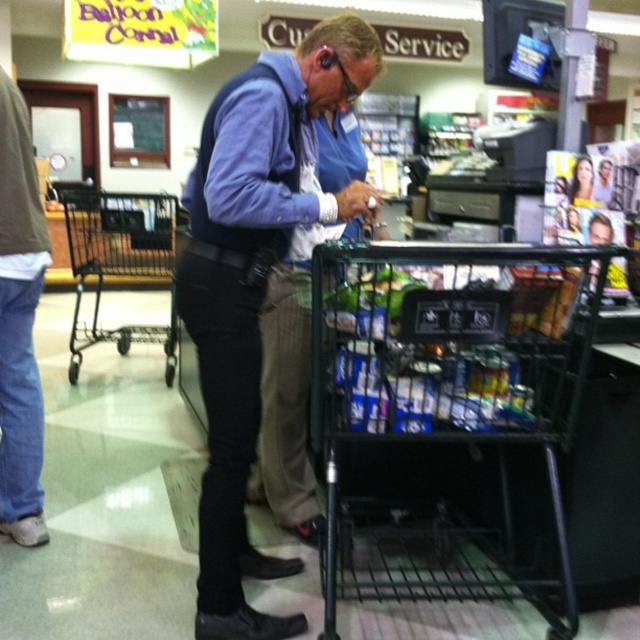
You are a customer in the store and want to ask the employee about the location of the nearest restroom. Which direction should you walk relative to the denim jeans at left to approach the matte blue shirt at center?

You should walk to the right of the denim jeans at left to approach the matte blue shirt at center because the matte blue shirt at center is positioned to the right of denim jeans at left.

You are a customer in the grocery store and want to know which of the two points, point (408, 433) or point (108, 330), is closer to you. Can you determine this based on the scene?

Point (408, 433) is closer to the viewer than point (108, 330).

You are a customer trying to reach the checkout counter in the grocery store. There is a black metal shopping cart at lower center and a matte blue shirt at center. Which object is closer to you from your perspective?

The black metal shopping cart at lower center is positioned under matte blue shirt at center, so the shopping cart is closer to you.